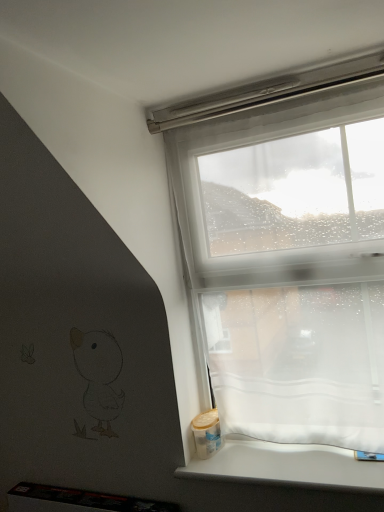
Question: In terms of height, does white matte window sill at lower right look taller or shorter compared to transparent fabric at upper right?

Choices:
 (A) tall
 (B) short

Answer: (B)

Question: Looking at the image, does white matte window sill at lower right seem bigger or smaller compared to transparent fabric at upper right?

Choices:
 (A) big
 (B) small

Answer: (B)

Question: From the image's perspective, is white matte window sill at lower right above or below transparent fabric at upper right?

Choices:
 (A) below
 (B) above

Answer: (A)

Question: Is transparent fabric at upper right in front of or behind white matte window sill at lower right in the image?

Choices:
 (A) front
 (B) behind

Answer: (B)

Question: Is point (375, 270) closer or farther from the camera than point (324, 465)?

Choices:
 (A) closer
 (B) farther

Answer: (A)

Question: From the image's perspective, is transparent fabric at upper right above or below white matte window sill at lower right?

Choices:
 (A) below
 (B) above

Answer: (B)

Question: Is transparent fabric at upper right bigger or smaller than white matte window sill at lower right?

Choices:
 (A) small
 (B) big

Answer: (B)